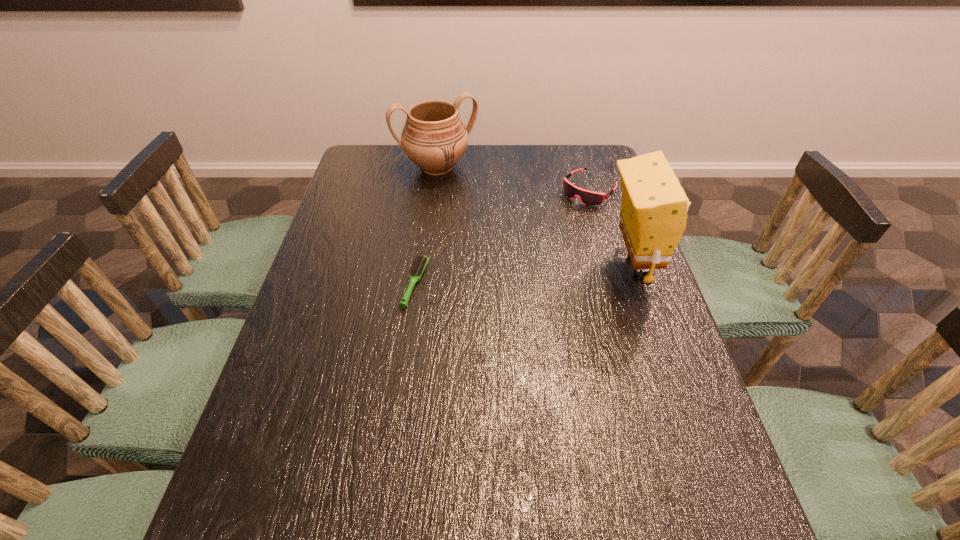
Locate an element on the screen. The height and width of the screenshot is (540, 960). blank region between the hairbrush and the third shortest object is located at coordinates point(426,225).

Locate an element on the screen. free space between the third shortest object and the shortest object is located at coordinates (426, 225).

Where is `free spot between the hairbrush and the tallest object`? free spot between the hairbrush and the tallest object is located at coordinates (524, 275).

Identify which object is the second closest to the sponge. Please provide its 2D coordinates. Your answer should be formatted as a tuple, i.e. [(x, y)], where the tuple contains the x and y coordinates of a point satisfying the conditions above.

[(434, 137)]

Find the location of a particular element. the closest object to the sponge is located at coordinates (589, 198).

Locate an element on the screen. The image size is (960, 540). vacant space that satisfies the following two spatial constraints: 1. on the back side of the shortest object; 2. on the left side of the urn is located at coordinates (431, 167).

This screenshot has width=960, height=540. Identify the location of free space that satisfies the following two spatial constraints: 1. on the front side of the urn; 2. on the left side of the third tallest object. (434, 190).

Where is `free region that satisfies the following two spatial constraints: 1. on the back side of the shortest object; 2. on the face of the sponge`? This screenshot has width=960, height=540. free region that satisfies the following two spatial constraints: 1. on the back side of the shortest object; 2. on the face of the sponge is located at coordinates (418, 266).